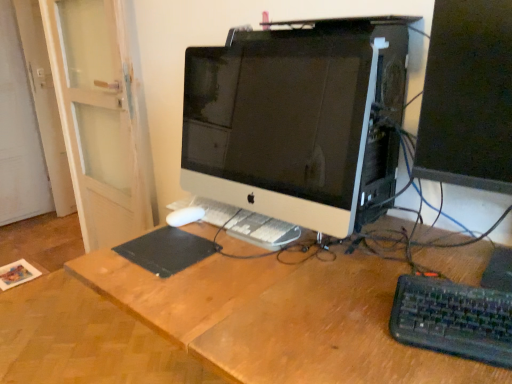
Question: Is black plastic keyboard at lower right shorter than white glossy computer monitor at center, which is counted as the 2th computer monitor, starting from the right?

Choices:
 (A) yes
 (B) no

Answer: (A)

Question: Considering the relative positions of black plastic keyboard at lower right and white glossy computer monitor at center, which is counted as the 2th computer monitor, starting from the right, in the image provided, is black plastic keyboard at lower right in front of white glossy computer monitor at center, which is counted as the 2th computer monitor, starting from the right,?

Choices:
 (A) no
 (B) yes

Answer: (B)

Question: From the image's perspective, is black plastic keyboard at lower right on white glossy computer monitor at center, which is counted as the 2th computer monitor, starting from the right?

Choices:
 (A) yes
 (B) no

Answer: (B)

Question: Does black plastic keyboard at lower right appear on the right side of white glossy computer monitor at center, which is counted as the 2th computer monitor, starting from the right?

Choices:
 (A) yes
 (B) no

Answer: (A)

Question: Can you confirm if black plastic keyboard at lower right is bigger than white glossy computer monitor at center, the first computer monitor viewed from the left?

Choices:
 (A) no
 (B) yes

Answer: (A)

Question: From a real-world perspective, does black plastic keyboard at lower right stand above white glossy computer monitor at center, which is counted as the 2th computer monitor, starting from the right?

Choices:
 (A) yes
 (B) no

Answer: (B)

Question: Is white glossy computer monitor at center, the first computer monitor viewed from the left, surrounded by matte black monitor at right, the 2th computer monitor from the left?

Choices:
 (A) yes
 (B) no

Answer: (B)

Question: Is matte black monitor at right, which is counted as the first computer monitor, starting from the right, aimed at white glossy computer monitor at center, the first computer monitor viewed from the left?

Choices:
 (A) yes
 (B) no

Answer: (B)

Question: Is matte black monitor at right, which is counted as the first computer monitor, starting from the right, next to white glossy computer monitor at center, the first computer monitor viewed from the left, and touching it?

Choices:
 (A) no
 (B) yes

Answer: (A)

Question: Considering the relative sizes of matte black monitor at right, the 2th computer monitor from the left, and white glossy computer monitor at center, the first computer monitor viewed from the left, in the image provided, is matte black monitor at right, the 2th computer monitor from the left, smaller than white glossy computer monitor at center, the first computer monitor viewed from the left,?

Choices:
 (A) no
 (B) yes

Answer: (B)

Question: Does matte black monitor at right, the 2th computer monitor from the left, have a lesser height compared to white glossy computer monitor at center, the first computer monitor viewed from the left?

Choices:
 (A) no
 (B) yes

Answer: (A)

Question: Would you say matte black monitor at right, the 2th computer monitor from the left, is a long distance from white glossy computer monitor at center, the first computer monitor viewed from the left?

Choices:
 (A) no
 (B) yes

Answer: (A)

Question: Does black plastic keyboard at lower right have a lesser height compared to matte black monitor at right, the 2th computer monitor from the left?

Choices:
 (A) no
 (B) yes

Answer: (B)